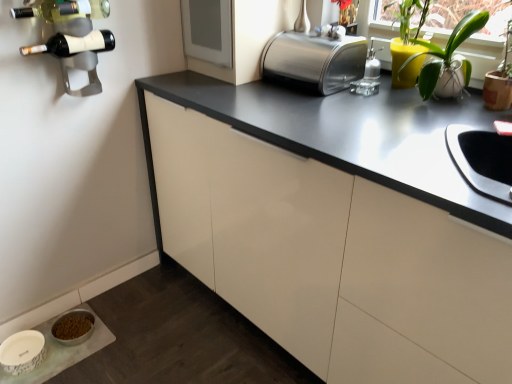
This screenshot has width=512, height=384. Find the location of `metallic wine rack at upper left`. metallic wine rack at upper left is located at coordinates (72, 37).

From the picture: Does white glossy pet food bowl at lower left lie behind polished stainless steel toaster at upper center?

Yes, white glossy pet food bowl at lower left is behind polished stainless steel toaster at upper center.

From the image's perspective, between white glossy pet food bowl at lower left and polished stainless steel toaster at upper center, who is located below?

white glossy pet food bowl at lower left, from the image's perspective.

Does white glossy pet food bowl at lower left have a greater height compared to polished stainless steel toaster at upper center?

No.

Is white glossy pet food bowl at lower left not within polished stainless steel toaster at upper center?

Yes, white glossy pet food bowl at lower left is outside of polished stainless steel toaster at upper center.

Where is `cabinetry on the right side of matte black wine bottle at upper left, positioned as the 2th wine bottle in top-to-bottom order`? This screenshot has width=512, height=384. cabinetry on the right side of matte black wine bottle at upper left, positioned as the 2th wine bottle in top-to-bottom order is located at coordinates (335, 227).

From the image's perspective, is matte white cabinet at center below matte black wine bottle at upper left, positioned as the 2th wine bottle in top-to-bottom order?

Yes, from the image's perspective, matte white cabinet at center is beneath matte black wine bottle at upper left, positioned as the 2th wine bottle in top-to-bottom order.

Does matte white cabinet at center contain matte black wine bottle at upper left, positioned as the 2th wine bottle in top-to-bottom order?

No, matte black wine bottle at upper left, positioned as the 2th wine bottle in top-to-bottom order, is not a part of matte white cabinet at center.

In the scene shown: Which of these two, matte white cabinet at center or matte black wine bottle at upper left, arranged as the 1th wine bottle when ordered from the bottom, stands shorter?

Standing shorter between the two is matte black wine bottle at upper left, arranged as the 1th wine bottle when ordered from the bottom.

Considering the sizes of objects matte white cabinet at center and metallic wine rack at upper left in the image provided, who is taller, matte white cabinet at center or metallic wine rack at upper left?

matte white cabinet at center.

From the image's perspective, which object appears higher, matte white cabinet at center or metallic wine rack at upper left?

metallic wine rack at upper left is shown above in the image.

Does point (330, 39) come farther from viewer compared to point (80, 39)?

That is True.

Considering the positions of objects polished stainless steel toaster at upper center and matte black wine bottle at upper left, arranged as the 1th wine bottle when ordered from the bottom, in the image provided, who is more to the right, polished stainless steel toaster at upper center or matte black wine bottle at upper left, arranged as the 1th wine bottle when ordered from the bottom,?

polished stainless steel toaster at upper center is more to the right.

From the image's perspective, is polished stainless steel toaster at upper center located above matte black wine bottle at upper left, positioned as the 2th wine bottle in top-to-bottom order?

Yes.

Is polished stainless steel toaster at upper center positioned beyond the bounds of matte black wine bottle at upper left, positioned as the 2th wine bottle in top-to-bottom order?

polished stainless steel toaster at upper center is positioned outside matte black wine bottle at upper left, positioned as the 2th wine bottle in top-to-bottom order.

From a real-world perspective, is polished stainless steel toaster at upper center located higher than metallic wine rack at upper left?

No, from a real-world perspective, polished stainless steel toaster at upper center is not on top of metallic wine rack at upper left.

Does point (321, 69) lie behind point (72, 16)?

Yes, it is.

Can you tell me how much polished stainless steel toaster at upper center and metallic wine rack at upper left differ in facing direction?

polished stainless steel toaster at upper center and metallic wine rack at upper left are facing 89.9 degrees away from each other.

From the image's perspective, is polished stainless steel toaster at upper center above or below metallic wine rack at upper left?

polished stainless steel toaster at upper center is situated higher than metallic wine rack at upper left in the image.

From the image's perspective, is green glass wine bottle at upper left, acting as the 1th wine bottle starting from the top, located above or below white ceramic pot at upper right?

green glass wine bottle at upper left, acting as the 1th wine bottle starting from the top, is situated higher than white ceramic pot at upper right in the image.

In the image, is green glass wine bottle at upper left, the second wine bottle in the bottom-to-top sequence, positioned in front of or behind white ceramic pot at upper right?

green glass wine bottle at upper left, the second wine bottle in the bottom-to-top sequence, is positioned closer to the viewer than white ceramic pot at upper right.

From a real-world perspective, which is physically above, green glass wine bottle at upper left, acting as the 1th wine bottle starting from the top, or white ceramic pot at upper right?

green glass wine bottle at upper left, acting as the 1th wine bottle starting from the top, is physically above.

Does point (75, 11) lie in front of point (458, 46)?

Yes, point (75, 11) is closer to viewer.

How distant is white glossy pet food bowl at lower left from white ceramic pot at upper right?

The distance of white glossy pet food bowl at lower left from white ceramic pot at upper right is 1.62 meters.

Which is closer, (78, 358) or (448, 42)?

The point (448, 42) is more forward.

Is white glossy pet food bowl at lower left facing away from white ceramic pot at upper right?

No, white glossy pet food bowl at lower left is not facing the opposite direction of white ceramic pot at upper right.

Looking at this image, which is in front, white glossy pet food bowl at lower left or white ceramic pot at upper right?

white ceramic pot at upper right is more forward.

Identify the location of toaster on the right of white glossy pet food bowl at lower left. This screenshot has width=512, height=384. (314, 61).

In the image, there is a matte black wine bottle at upper left, positioned as the 2th wine bottle in top-to-bottom order. Where is `cabinetry below it (from the image's perspective)`? cabinetry below it (from the image's perspective) is located at coordinates (335, 227).

Estimate the real-world distances between objects in this image. Which object is further from white glossy pet food bowl at lower left, metallic wine rack at upper left or matte black wine bottle at upper left, arranged as the 1th wine bottle when ordered from the bottom?

The object further to white glossy pet food bowl at lower left is matte black wine bottle at upper left, arranged as the 1th wine bottle when ordered from the bottom.

Which object lies further to the anchor point metallic wine rack at upper left, green glass wine bottle at upper left, the second wine bottle in the bottom-to-top sequence, or white glossy pet food bowl at lower left?

white glossy pet food bowl at lower left lies further to metallic wine rack at upper left than the other object.

Based on their spatial positions, is white ceramic pot at upper right or white glossy pet food bowl at lower left further from matte black wine bottle at upper left, arranged as the 1th wine bottle when ordered from the bottom?

white ceramic pot at upper right lies further to matte black wine bottle at upper left, arranged as the 1th wine bottle when ordered from the bottom, than the other object.

Estimate the real-world distances between objects in this image. Which object is closer to matte white cabinet at center, green glass wine bottle at upper left, the second wine bottle in the bottom-to-top sequence, or polished stainless steel toaster at upper center?

Based on the image, polished stainless steel toaster at upper center appears to be nearer to matte white cabinet at center.

Looking at this image, which object lies nearer to the anchor point white glossy pet food bowl at lower left, metallic wine rack at upper left or polished stainless steel toaster at upper center?

Among the two, metallic wine rack at upper left is located nearer to white glossy pet food bowl at lower left.

Based on their spatial positions, is green glass wine bottle at upper left, the second wine bottle in the bottom-to-top sequence, or white ceramic pot at upper right further from matte black wine bottle at upper left, arranged as the 1th wine bottle when ordered from the bottom?

The object further to matte black wine bottle at upper left, arranged as the 1th wine bottle when ordered from the bottom, is white ceramic pot at upper right.

From the image, which object appears to be nearer to polished stainless steel toaster at upper center, matte white cabinet at center or metallic wine rack at upper left?

Based on the image, matte white cabinet at center appears to be nearer to polished stainless steel toaster at upper center.

Estimate the real-world distances between objects in this image. Which object is further from green glass wine bottle at upper left, the second wine bottle in the bottom-to-top sequence, white glossy pet food bowl at lower left or white ceramic pot at upper right?

The object further to green glass wine bottle at upper left, the second wine bottle in the bottom-to-top sequence, is white glossy pet food bowl at lower left.

Identify the location of cabinetry situated between metallic wine rack at upper left and white ceramic pot at upper right from left to right. (335, 227).

Where is `toaster between matte black wine bottle at upper left, arranged as the 1th wine bottle when ordered from the bottom, and white ceramic pot at upper right`? The height and width of the screenshot is (384, 512). toaster between matte black wine bottle at upper left, arranged as the 1th wine bottle when ordered from the bottom, and white ceramic pot at upper right is located at coordinates (314, 61).

I want to click on cabinetry located between white glossy pet food bowl at lower left and polished stainless steel toaster at upper center in the left-right direction, so click(x=335, y=227).

Find the location of `houseplant between polished stainless steel toaster at upper center and matte white cabinet at center in the up-down direction`. houseplant between polished stainless steel toaster at upper center and matte white cabinet at center in the up-down direction is located at coordinates (443, 52).